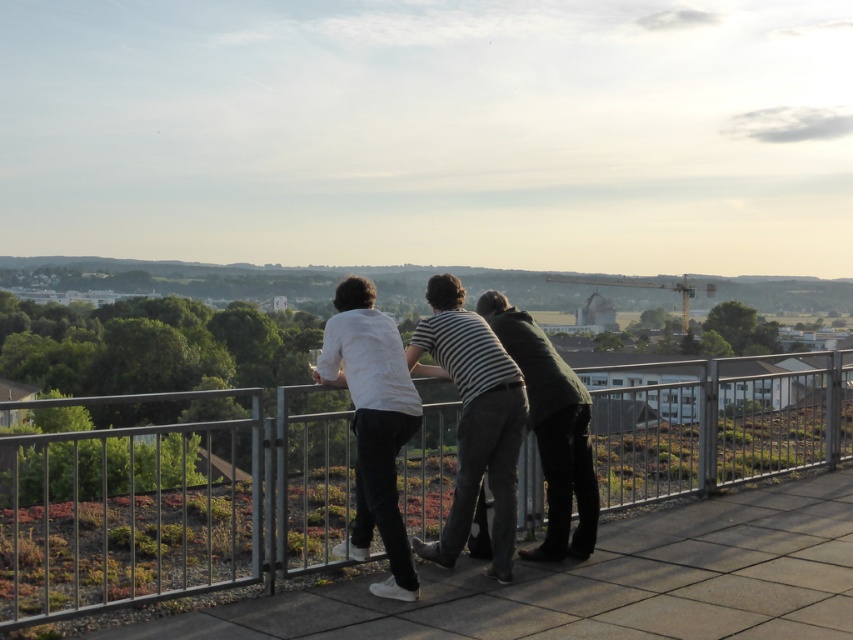
You are standing on the rooftop terrace and want to see the view beyond the metallic silver fence at center. However, the white matte shirt at center is blocking your view. Which direction should you move to get a clear view of the area beyond the fence?

You should move to the right of the white matte shirt at center because the metallic silver fence at center is located below it, so moving sideways around the shirt would allow you to see beyond the fence.

You are standing on the rooftop terrace and want to move from point A to point B. Point A is located at coordinates point (460,520) and point B is at point (380,349). Which direction should you move to get from point A to point B?

To move from point A to point B, you should move forward because point A is behind point B.